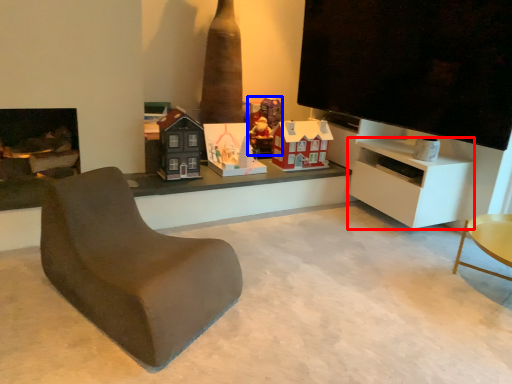
Question: Which of the following is the farthest to the observer, cabinetry (highlighted by a red box) or toy (highlighted by a blue box)?

Choices:
 (A) cabinetry
 (B) toy

Answer: (B)